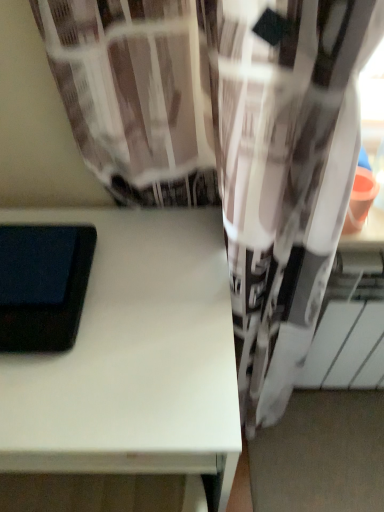
Where is `free location to the right of black matte tablet at left`? Image resolution: width=384 pixels, height=512 pixels. free location to the right of black matte tablet at left is located at coordinates (146, 302).